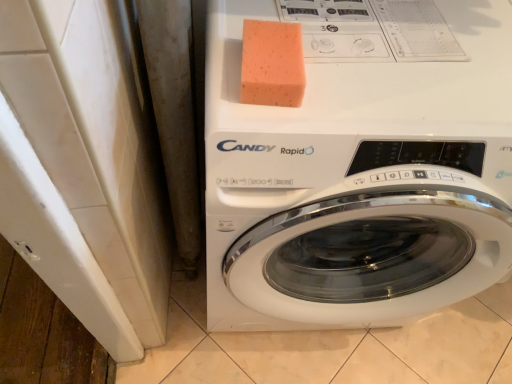
You are a GUI agent. You are given a task and a screenshot of the screen. Output one action in this format:
    pyautogui.click(x=<x>, y=<y>)
    Task: Click on the vacant space to the right of orange sponge at upper center
    
    Given the screenshot: What is the action you would take?
    pyautogui.click(x=372, y=79)